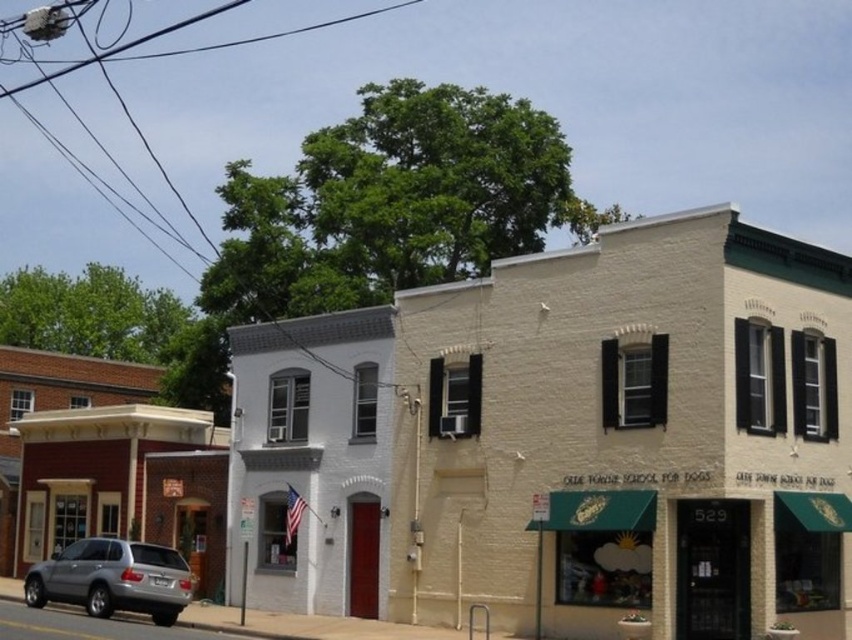
Question: Which is nearer to the silver metallic suv at lower left?

Choices:
 (A) black wire at upper center
 (B) brick storefront at left
 (C) black wire at upper left
 (D) white matte building at center

Answer: (D)

Question: Which point is farther to the camera?

Choices:
 (A) (14, 88)
 (B) (204, 412)

Answer: (A)

Question: Can you confirm if silver metallic suv at lower left is bigger than black wire at upper left?

Choices:
 (A) no
 (B) yes

Answer: (A)

Question: Can you confirm if white matte building at center is positioned to the left of silver metallic suv at lower left?

Choices:
 (A) yes
 (B) no

Answer: (B)

Question: Considering the real-world distances, which object is closest to the black wire at upper center?

Choices:
 (A) silver metallic suv at lower left
 (B) black wire at upper left
 (C) brick storefront at left

Answer: (B)

Question: Is black wire at upper left closer to the viewer compared to black wire at upper center?

Choices:
 (A) no
 (B) yes

Answer: (B)